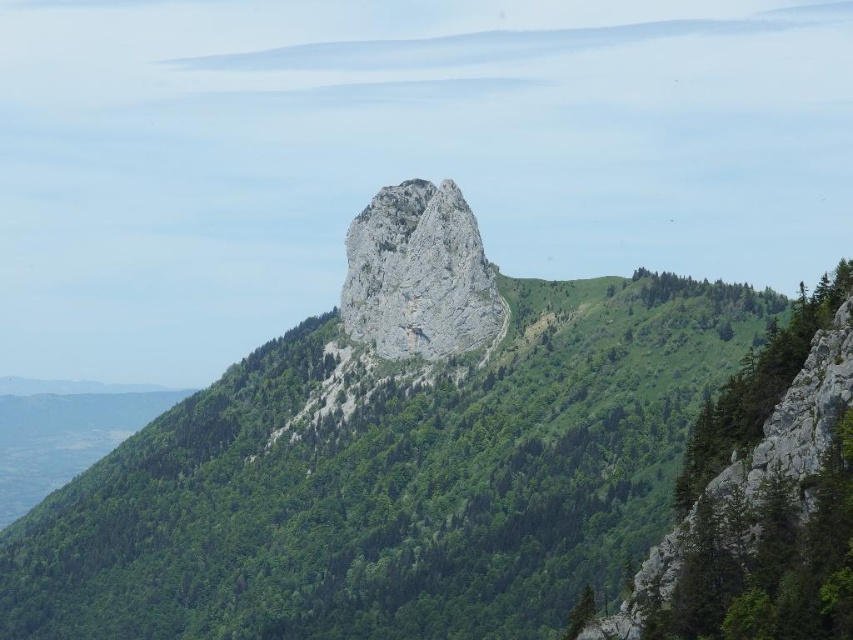
You are standing at the base of the mountain and looking at the two points marked in the image. Which point, point (376,534) or point (352,298), is closer to you?

Point (376,534) is closer to you than point (352,298).

You are standing in the forest and see the green leafy tree at center and the gray rocky peak at center. Which one is positioned more to the left?

The green leafy tree at center is positioned to the left of the gray rocky peak at center, so it is more to the left.